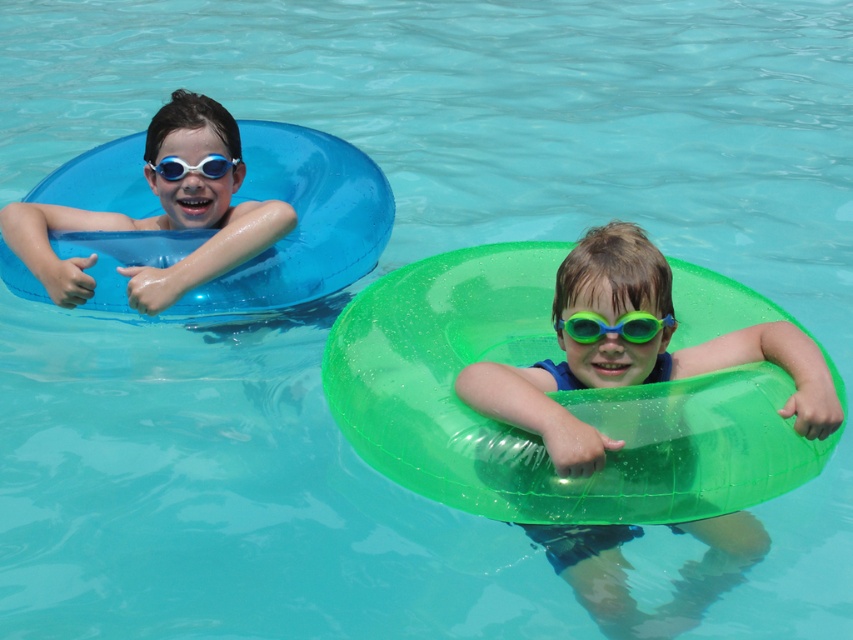
You are a lifeguard at the pool and need to determine which object is larger between the green translucent tube at right and the blue rubber goggles at left. Based on the scene, which one is bigger?

The green translucent tube at right is bigger than the blue rubber goggles at left according to the description.

You are a lifeguard standing at the edge of the pool. You need to locate the green translucent tube at right. What are the coordinates of its position?

The coordinates of the green translucent tube at right are at point (633, 353).

You are a lifeguard trying to ensure safety at the pool. You notice two items at the left side of the pool area. The items are the matte blue swim ring at left and the blue rubber goggles at left. Based on their sizes, which item would require more space to store properly?

The matte blue swim ring at left might be wider than blue rubber goggles at left, so the matte blue swim ring at left would require more space to store properly.